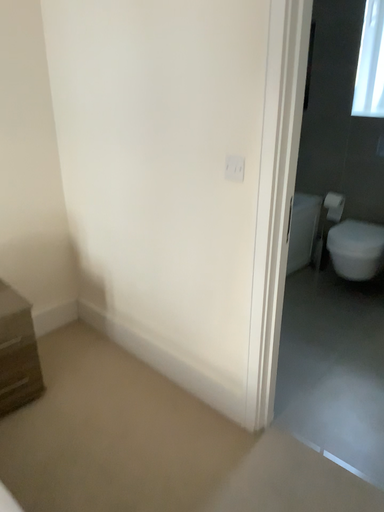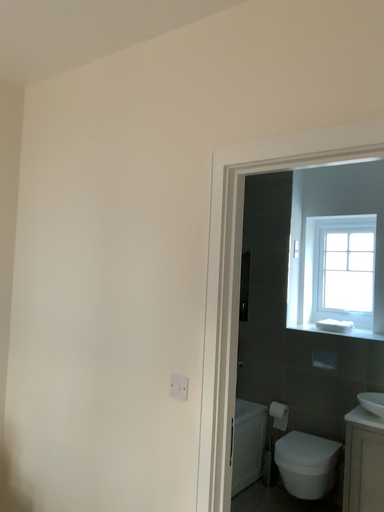
Question: Which way did the camera rotate in the video?

Choices:
 (A) rotated left
 (B) rotated right

Answer: (B)